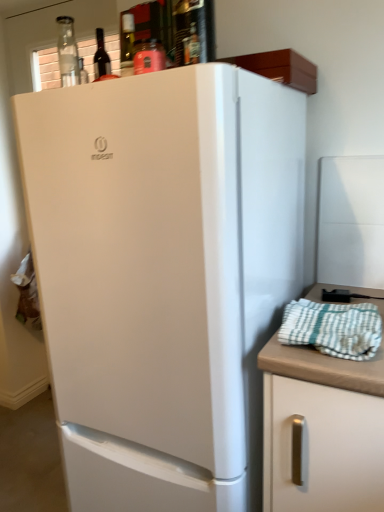
Question: Does white matte refrigerator at center have a lesser width compared to white matte cabinet at right?

Choices:
 (A) yes
 (B) no

Answer: (B)

Question: Could white matte cabinet at right be considered to be inside white matte refrigerator at center?

Choices:
 (A) yes
 (B) no

Answer: (B)

Question: Could you tell me if white matte refrigerator at center is turned towards white matte cabinet at right?

Choices:
 (A) yes
 (B) no

Answer: (B)

Question: Can you see white matte refrigerator at center touching white matte cabinet at right?

Choices:
 (A) no
 (B) yes

Answer: (A)

Question: From a real-world perspective, is white matte refrigerator at center over white matte cabinet at right?

Choices:
 (A) no
 (B) yes

Answer: (B)

Question: In terms of size, does white checkered towel at right appear bigger or smaller than white matte cabinet at right?

Choices:
 (A) big
 (B) small

Answer: (B)

Question: Would you say white checkered towel at right is inside or outside white matte cabinet at right?

Choices:
 (A) inside
 (B) outside

Answer: (B)

Question: From a real-world perspective, relative to white matte cabinet at right, is white checkered towel at right vertically above or below?

Choices:
 (A) above
 (B) below

Answer: (A)

Question: Visually, is white checkered towel at right positioned to the left or to the right of white matte cabinet at right?

Choices:
 (A) right
 (B) left

Answer: (B)

Question: Is white matte cabinet at right inside the boundaries of white checkered towel at right, or outside?

Choices:
 (A) inside
 (B) outside

Answer: (B)

Question: Is point (306, 400) positioned closer to the camera than point (314, 340)?

Choices:
 (A) closer
 (B) farther

Answer: (A)

Question: From a real-world perspective, is white matte cabinet at right physically located above or below white checkered towel at right?

Choices:
 (A) below
 (B) above

Answer: (A)

Question: Is white matte cabinet at right to the left or to the right of white checkered towel at right in the image?

Choices:
 (A) left
 (B) right

Answer: (B)

Question: Considering the positions of point (84, 133) and point (319, 435), is point (84, 133) closer or farther from the camera than point (319, 435)?

Choices:
 (A) closer
 (B) farther

Answer: (B)

Question: Considering the positions of white matte refrigerator at center and white matte cabinet at right in the image, is white matte refrigerator at center bigger or smaller than white matte cabinet at right?

Choices:
 (A) small
 (B) big

Answer: (B)